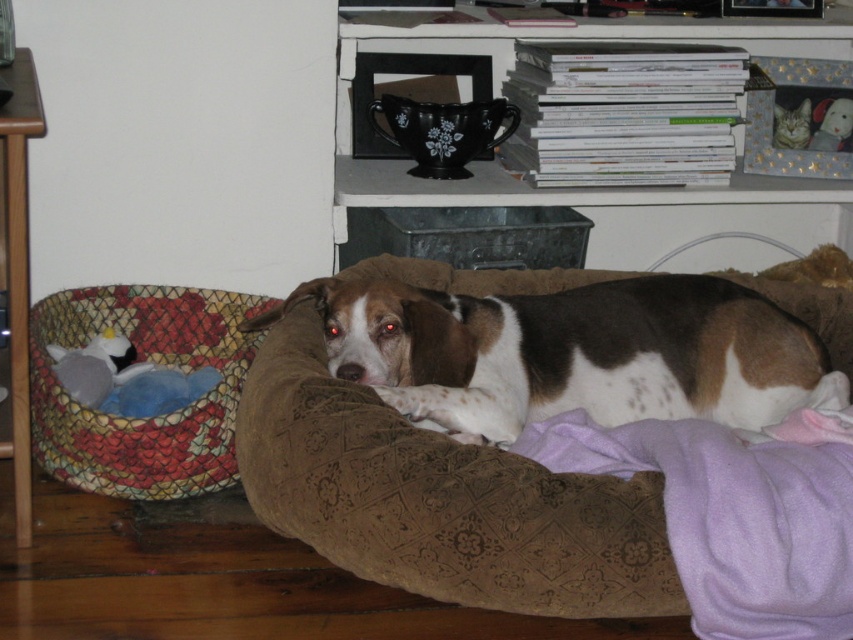
Question: Is brown and white fur at center below multicolored woven basket at left?

Choices:
 (A) no
 (B) yes

Answer: (A)

Question: Does brown and white fur at center have a smaller size compared to black ceramic mug at upper center?

Choices:
 (A) yes
 (B) no

Answer: (A)

Question: Estimate the real-world distances between objects in this image. Which object is closer to the brown velvety dog bed at center?

Choices:
 (A) black ceramic mug at upper center
 (B) brown and white fur at center

Answer: (B)

Question: Which point is closer to the camera taking this photo?

Choices:
 (A) (595, 237)
 (B) (45, 372)
 (C) (647, 536)
 (D) (804, 333)

Answer: (C)

Question: Can you confirm if brown and white fur at center is positioned below black ceramic mug at upper center?

Choices:
 (A) no
 (B) yes

Answer: (B)

Question: Among these objects, which one is nearest to the camera?

Choices:
 (A) multicolored woven basket at left
 (B) black ceramic mug at upper center
 (C) brown velvety dog bed at center
 (D) brown and white fur at center

Answer: (C)